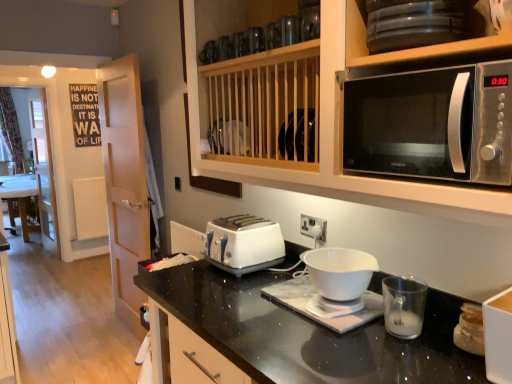
Question: Does white glossy bowl at center, which is the 1th appliance in back-to-front order, turn towards white glossy door at left?

Choices:
 (A) yes
 (B) no

Answer: (B)

Question: Does white glossy bowl at center, which is the 1th appliance in back-to-front order, have a larger size compared to white glossy door at left?

Choices:
 (A) no
 (B) yes

Answer: (A)

Question: From a real-world perspective, is white glossy bowl at center, which is the 1th appliance in back-to-front order, located higher than white glossy door at left?

Choices:
 (A) yes
 (B) no

Answer: (B)

Question: Is white glossy bowl at center, which is the 1th appliance in back-to-front order, oriented away from white glossy door at left?

Choices:
 (A) yes
 (B) no

Answer: (B)

Question: Could white glossy door at left be considered to be inside white glossy bowl at center, the 2th appliance positioned from the front?

Choices:
 (A) yes
 (B) no

Answer: (B)

Question: From the image's perspective, is white glossy bowl at center, the 2th appliance positioned from the front, located above white glossy door at left?

Choices:
 (A) no
 (B) yes

Answer: (A)

Question: Considering the relative sizes of white plastic electric outlet at center and white glossy door at left in the image provided, is white plastic electric outlet at center smaller than white glossy door at left?

Choices:
 (A) no
 (B) yes

Answer: (B)

Question: Is white plastic electric outlet at center shorter than white glossy door at left?

Choices:
 (A) yes
 (B) no

Answer: (A)

Question: From the image's perspective, does white plastic electric outlet at center appear lower than white glossy door at left?

Choices:
 (A) no
 (B) yes

Answer: (B)

Question: From a real-world perspective, is white plastic electric outlet at center located beneath white glossy door at left?

Choices:
 (A) yes
 (B) no

Answer: (B)

Question: Is white plastic electric outlet at center completely or partially outside of white glossy door at left?

Choices:
 (A) yes
 (B) no

Answer: (A)

Question: Is white plastic electric outlet at center wider than white glossy door at left?

Choices:
 (A) yes
 (B) no

Answer: (B)

Question: Is white plastic toaster at center facing away from satin silver microwave at upper right?

Choices:
 (A) yes
 (B) no

Answer: (B)